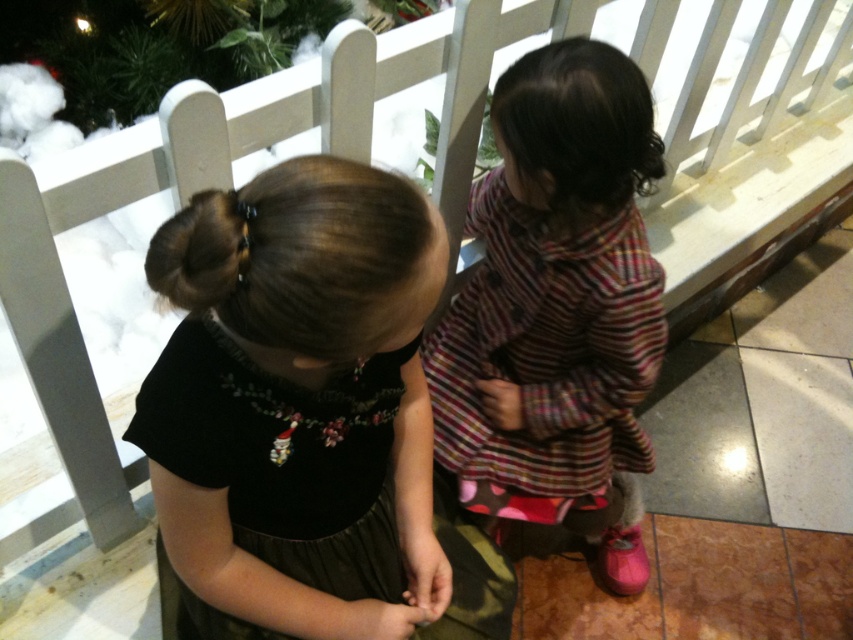
Can you confirm if striped fabric dress at center is positioned to the left of black velvet dress at center?

No, striped fabric dress at center is not to the left of black velvet dress at center.

Which is more to the left, striped fabric dress at center or black velvet dress at center?

black velvet dress at center is more to the left.

Between point (642, 264) and point (334, 512), which one is positioned in front?

Positioned in front is point (334, 512).

Where is `striped fabric dress at center`? striped fabric dress at center is located at coordinates (558, 307).